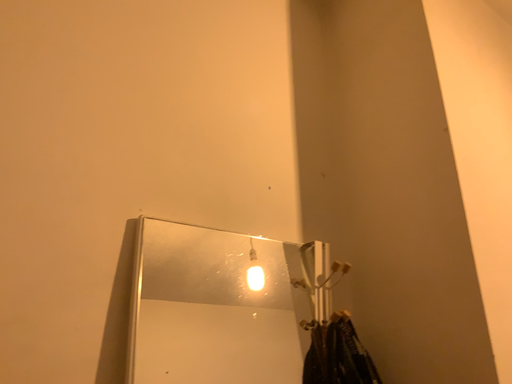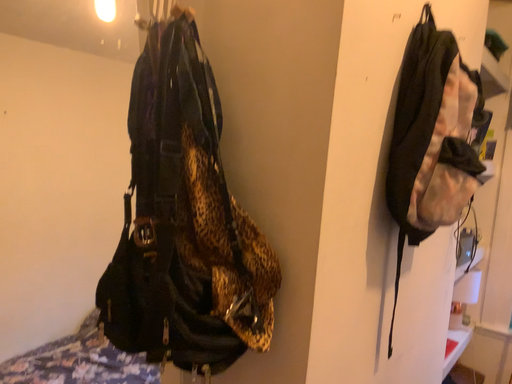
Question: Which way did the camera rotate in the video?

Choices:
 (A) rotated right
 (B) rotated left

Answer: (A)